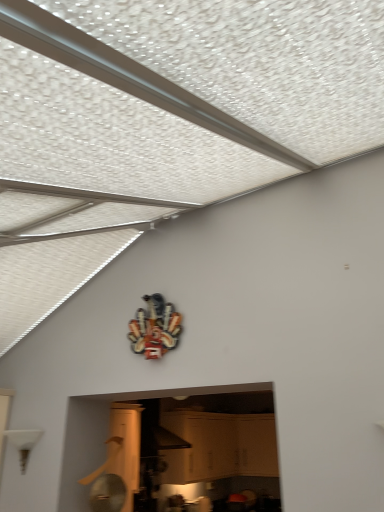
I want to click on white matte cabinet at center, so click(x=219, y=446).

The width and height of the screenshot is (384, 512). What do you see at coordinates (219, 446) in the screenshot? I see `white matte cabinet at center` at bounding box center [219, 446].

Where is `metallic multi-tool at upper center`? metallic multi-tool at upper center is located at coordinates (155, 328).

The width and height of the screenshot is (384, 512). Describe the element at coordinates (155, 328) in the screenshot. I see `metallic multi-tool at upper center` at that location.

In order to click on white matte cabinet at center in this screenshot , I will do `click(219, 446)`.

Considering the positions of objects metallic multi-tool at upper center and white matte cabinet at center in the image provided, who is more to the right, metallic multi-tool at upper center or white matte cabinet at center?

From the viewer's perspective, white matte cabinet at center appears more on the right side.

Who is more distant, metallic multi-tool at upper center or white matte cabinet at center?

white matte cabinet at center is behind.

Considering the positions of point (140, 312) and point (214, 439), is point (140, 312) closer or farther from the camera than point (214, 439)?

Point (140, 312) is positioned closer to the camera compared to point (214, 439).

From the image's perspective, which is below, metallic multi-tool at upper center or white matte cabinet at center?

white matte cabinet at center.

From a real-world perspective, is metallic multi-tool at upper center physically located above or below white matte cabinet at center?

In terms of real-world spatial position, metallic multi-tool at upper center is above white matte cabinet at center.

Is metallic multi-tool at upper center thinner than white matte cabinet at center?

Yes.

Can you confirm if metallic multi-tool at upper center is shorter than white matte cabinet at center?

Yes, metallic multi-tool at upper center is shorter than white matte cabinet at center.

Between metallic multi-tool at upper center and white matte cabinet at center, which one has larger size?

white matte cabinet at center is bigger.

Could white matte cabinet at center be considered to be inside metallic multi-tool at upper center?

No.

Does metallic multi-tool at upper center touch white matte cabinet at center?

metallic multi-tool at upper center is not next to white matte cabinet at center, and they're not touching.

Is white matte cabinet at center at the back of metallic multi-tool at upper center?

No, metallic multi-tool at upper center is not facing the opposite direction of white matte cabinet at center.

How distant is metallic multi-tool at upper center from white matte cabinet at center?

They are 3.90 meters apart.

Where is `design above the white matte cabinet at center (from a real-world perspective)`? This screenshot has width=384, height=512. design above the white matte cabinet at center (from a real-world perspective) is located at coordinates (155, 328).

Which is more to the right, white matte cabinet at center or metallic multi-tool at upper center?

white matte cabinet at center is more to the right.

Does white matte cabinet at center lie in front of metallic multi-tool at upper center?

No, the depth of white matte cabinet at center is greater than that of metallic multi-tool at upper center.

Is point (202, 464) closer to viewer compared to point (158, 328)?

No, it is not.

From the image's perspective, which is below, white matte cabinet at center or metallic multi-tool at upper center?

white matte cabinet at center appears lower in the image.

From a real-world perspective, is white matte cabinet at center above or below metallic multi-tool at upper center?

white matte cabinet at center is below metallic multi-tool at upper center.

Looking at their sizes, would you say white matte cabinet at center is wider or thinner than metallic multi-tool at upper center?

In the image, white matte cabinet at center appears to be wider than metallic multi-tool at upper center.

Based on the photo, between white matte cabinet at center and metallic multi-tool at upper center, which one has less height?

metallic multi-tool at upper center.

Can you confirm if white matte cabinet at center is bigger than metallic multi-tool at upper center?

Yes.

From the picture: Is white matte cabinet at center spatially inside metallic multi-tool at upper center, or outside of it?

white matte cabinet at center is not inside metallic multi-tool at upper center, it's outside.

Is white matte cabinet at center next to metallic multi-tool at upper center?

They are not placed beside each other.

Could you tell me if white matte cabinet at center is facing metallic multi-tool at upper center?

No, white matte cabinet at center does not turn towards metallic multi-tool at upper center.

How many degrees apart are the facing directions of white matte cabinet at center and metallic multi-tool at upper center?

89.4 degrees.

The width and height of the screenshot is (384, 512). I want to click on cabinetry that is under the metallic multi-tool at upper center (from a real-world perspective), so click(x=219, y=446).

Where is `design above the white matte cabinet at center (from a real-world perspective)`? design above the white matte cabinet at center (from a real-world perspective) is located at coordinates (155, 328).

Where is `cabinetry below the metallic multi-tool at upper center (from the image's perspective)`? This screenshot has height=512, width=384. cabinetry below the metallic multi-tool at upper center (from the image's perspective) is located at coordinates (219, 446).